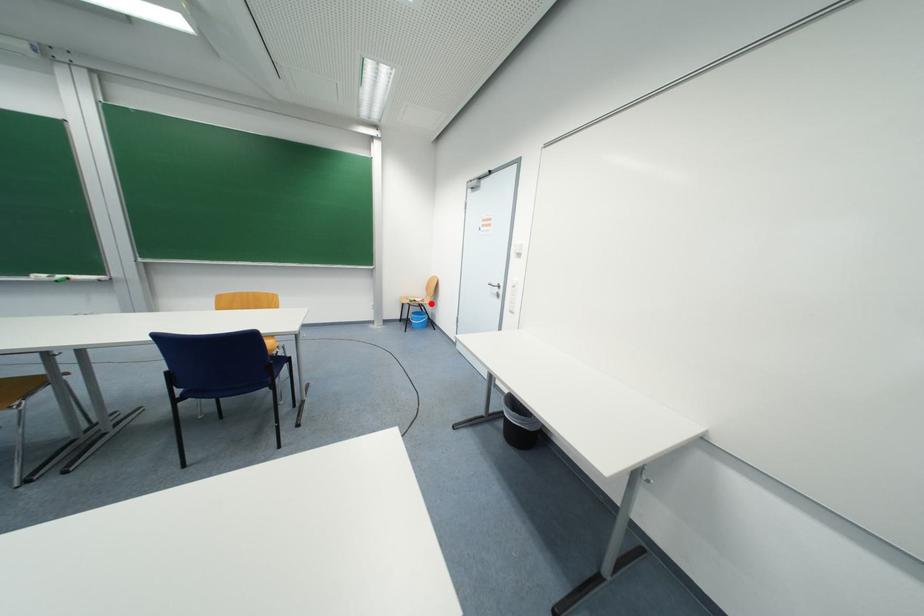
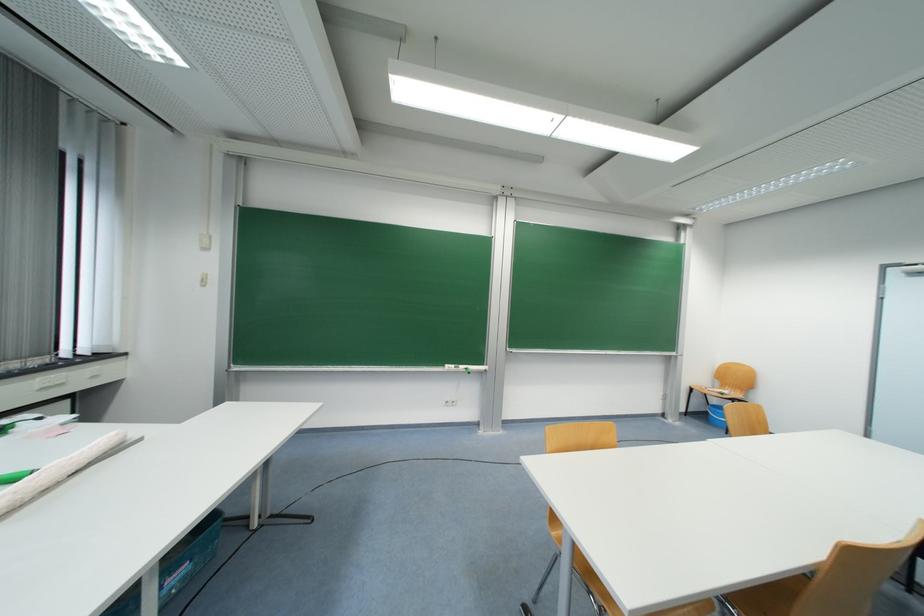
Question: I am providing you with two images of the same scene from different viewpoints. In image1, a red point is highlighted. Considering the same 3D point in image2, which of the following is correct?

Choices:
 (A) It is closer
 (B) It is farther

Answer: (B)